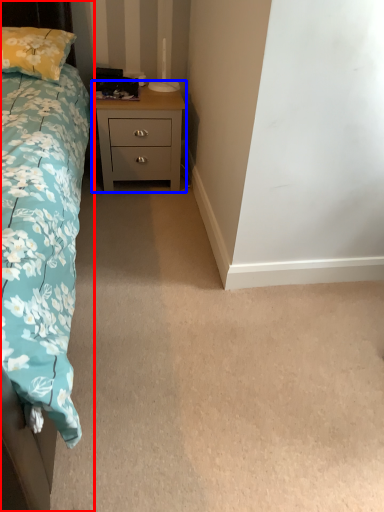
Question: Which object appears farthest to the camera in this image, bed (highlighted by a red box) or nightstand (highlighted by a blue box)?

Choices:
 (A) bed
 (B) nightstand

Answer: (B)